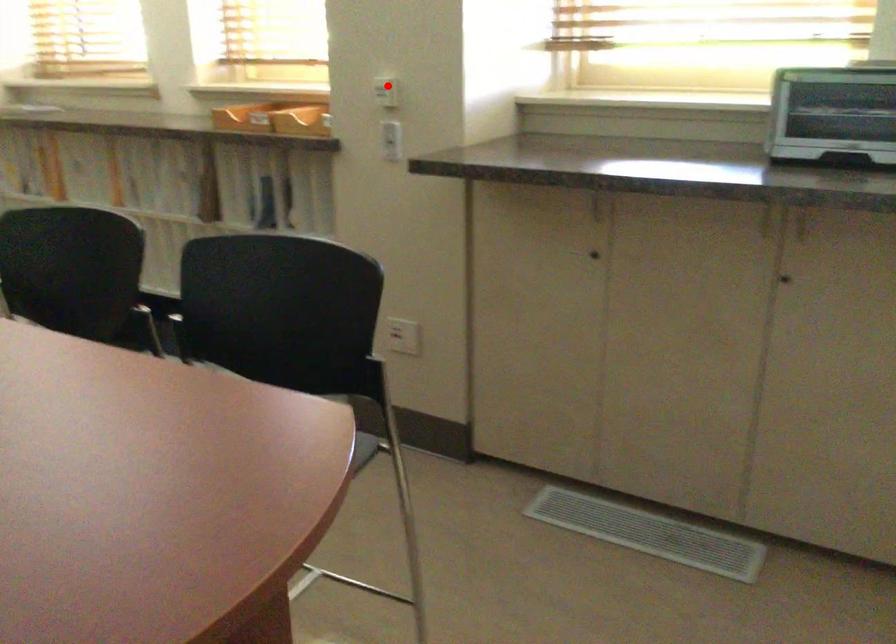
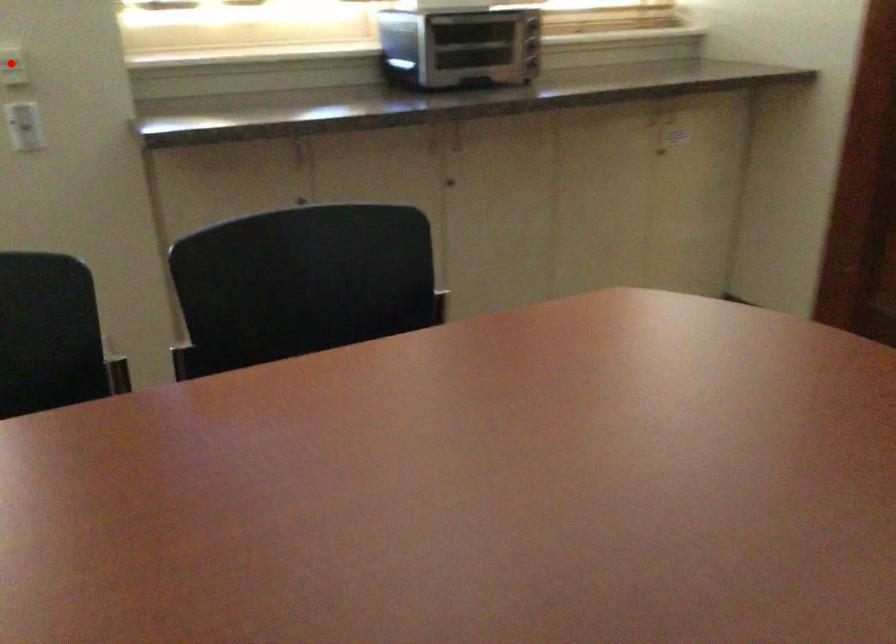
I am providing you with two images of the same scene from different viewpoints. A red point is marked on the first image and another point is marked on the second image. Is the marked point in image1 the same physical position as the marked point in image2?

Yes